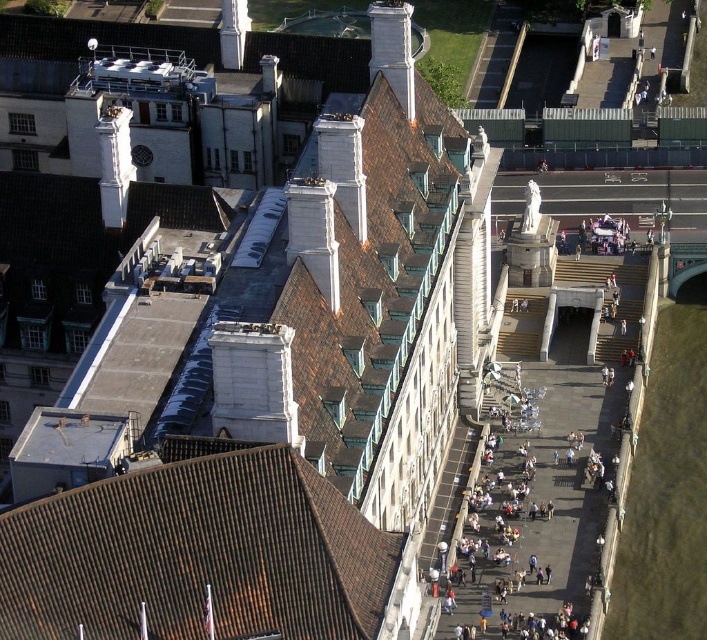
Question: Is brown tile roof at lower left smaller than white stone chimney at upper center?

Choices:
 (A) no
 (B) yes

Answer: (A)

Question: Which of the following is the farthest from the observer?

Choices:
 (A) click(x=379, y=8)
 (B) click(x=163, y=630)

Answer: (A)

Question: Observing the image, what is the correct spatial positioning of brown tile roof at lower left in reference to white stone chimney at upper center?

Choices:
 (A) right
 (B) left

Answer: (B)

Question: Does brown tile roof at lower left have a smaller size compared to white stone chimney at upper center?

Choices:
 (A) yes
 (B) no

Answer: (B)